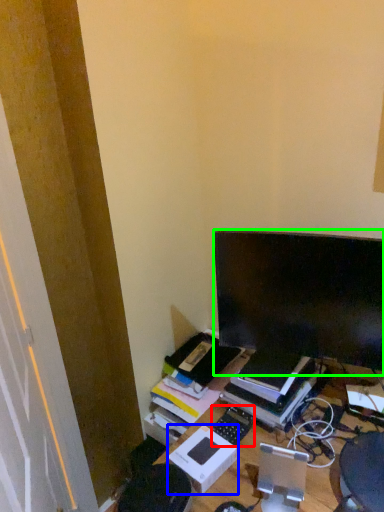
Question: Considering the real-world distances, which object is closest to computer keyboard (highlighted by a red box)? cardboard box (highlighted by a blue box) or computer monitor (highlighted by a green box).

Choices:
 (A) cardboard box
 (B) computer monitor

Answer: (A)